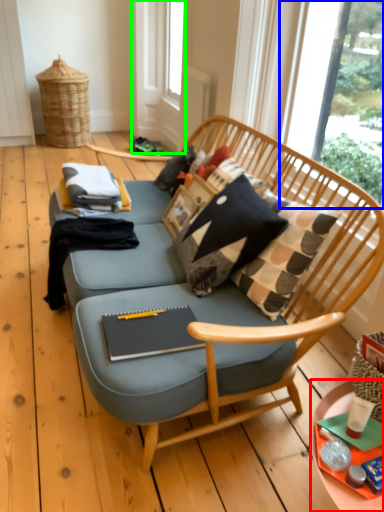
Question: Based on their relative distances, which object is farther from desk (highlighted by a red box)? Choose from window screen (highlighted by a blue box) and screen door (highlighted by a green box).

Choices:
 (A) window screen
 (B) screen door

Answer: (B)